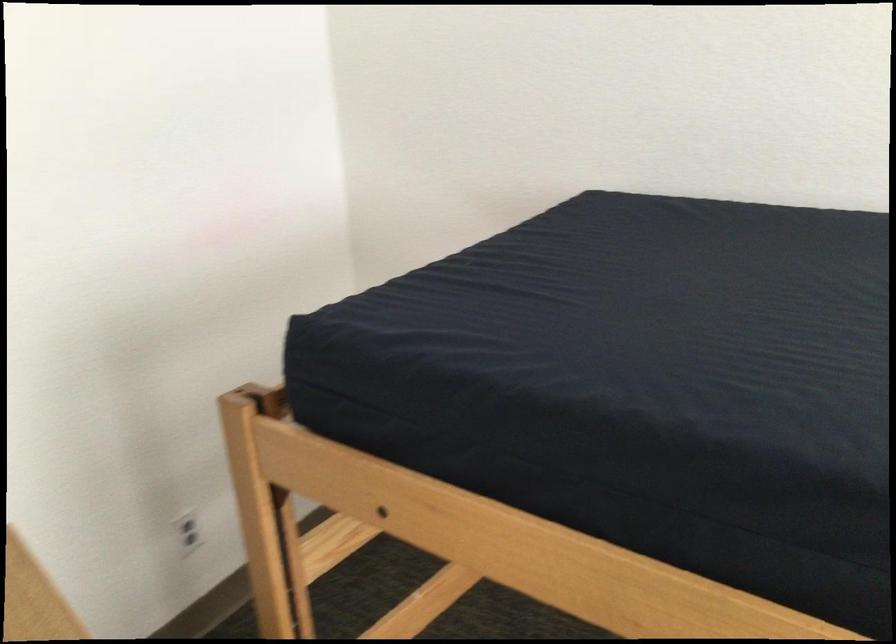
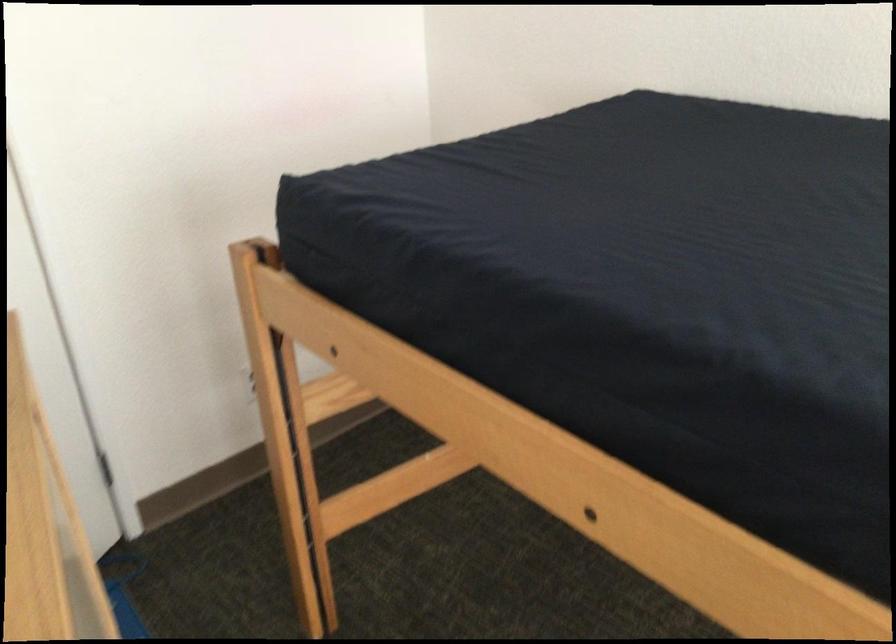
In the second image, find the point that corresponds to (716,346) in the first image.

(636, 228)